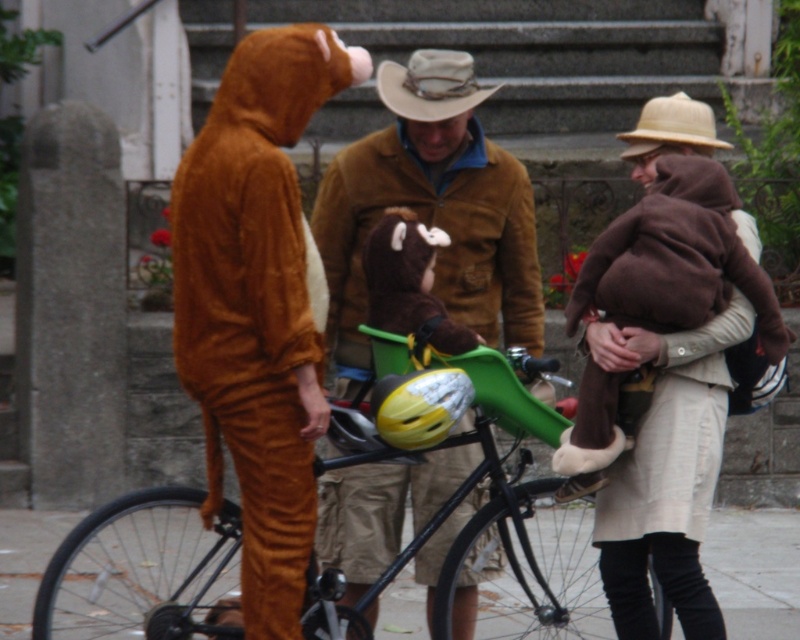
Is green matte bicycle at center wider than brown suede jacket at center?

Yes, green matte bicycle at center is wider than brown suede jacket at center.

Is green matte bicycle at center further to camera compared to brown suede jacket at center?

No, green matte bicycle at center is closer to the viewer.

Which is behind, point (236, 531) or point (388, 529)?

Positioned behind is point (388, 529).

Locate an element on the screen. The width and height of the screenshot is (800, 640). green matte bicycle at center is located at coordinates (516, 509).

Does brown plush bear at center have a smaller size compared to brown felt cowboy hat at upper center?

No.

Is brown plush bear at center shorter than brown felt cowboy hat at upper center?

Incorrect, brown plush bear at center's height does not fall short of brown felt cowboy hat at upper center's.

Is point (426, 228) closer to viewer compared to point (646, 141)?

Yes, point (426, 228) is in front of point (646, 141).

Find the location of a particular element. Image resolution: width=800 pixels, height=640 pixels. brown plush bear at center is located at coordinates (408, 282).

Who is positioned more to the left, green matte bicycle at center or beige wool coat at center?

green matte bicycle at center

Can you confirm if green matte bicycle at center is thinner than beige wool coat at center?

No.

Where is `green matte bicycle at center`? green matte bicycle at center is located at coordinates (516, 509).